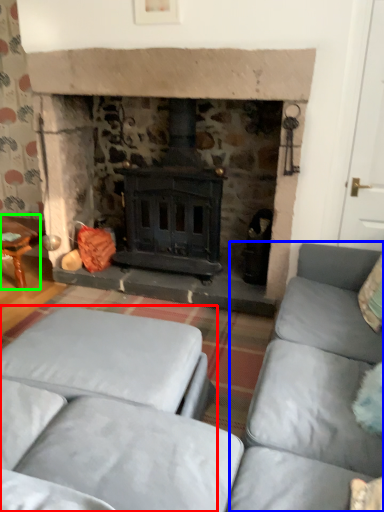
Question: Which object is the closest to the studio couch (highlighted by a red box)? Choose among these: couch (highlighted by a blue box) or table (highlighted by a green box).

Choices:
 (A) couch
 (B) table

Answer: (A)